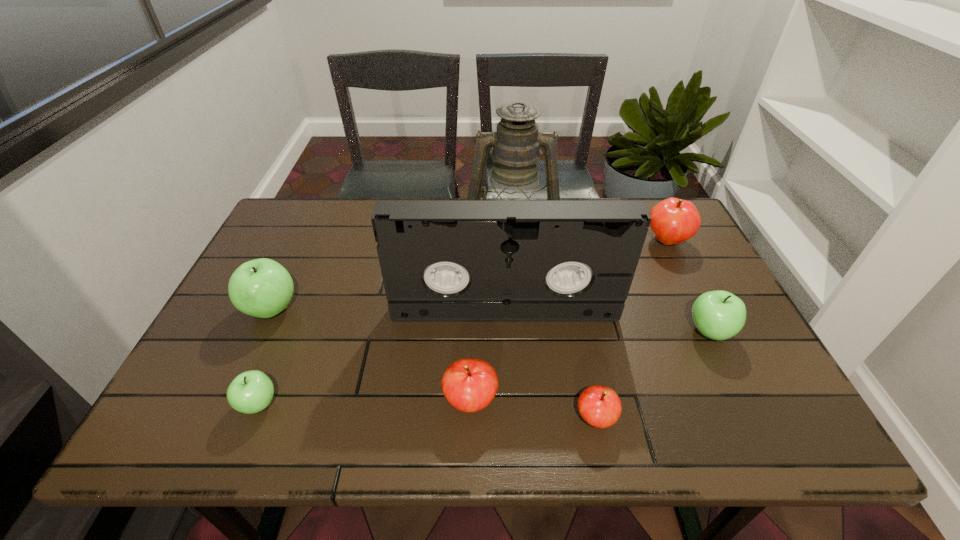
Find the location of a particular element. This screenshot has height=540, width=960. unoccupied area between the nearest green apple and the seventh shortest object is located at coordinates (381, 357).

Find the location of a particular element. free spot between the second smallest green apple and the second biggest red apple is located at coordinates (589, 366).

This screenshot has width=960, height=540. In order to click on vacant space in between the fourth apple from left to right and the biggest green apple in this screenshot , I will do `click(433, 364)`.

The image size is (960, 540). What are the coordinates of `free space between the nearest green apple and the oil lamp` in the screenshot? It's located at (385, 321).

Image resolution: width=960 pixels, height=540 pixels. I want to click on unoccupied position between the leftmost red apple and the second red apple from right to left, so click(533, 410).

Identify the location of object that ranks as the closest to the tallest object. (441, 260).

This screenshot has width=960, height=540. What are the coordinates of `the second closest object to the rightmost green apple` in the screenshot? It's located at (673, 221).

Select which apple appears as the closest to the second biggest green apple. Please provide its 2D coordinates. Your answer should be formatted as a tuple, i.e. [(x, y)], where the tuple contains the x and y coordinates of a point satisfying the conditions above.

[(673, 221)]

The height and width of the screenshot is (540, 960). Identify the location of apple that is the third closest to the fourth apple from right to left. [262, 288].

Locate which green apple is the closest to the second red apple from right to left. Please provide its 2D coordinates. Your answer should be formatted as a tuple, i.e. [(x, y)], where the tuple contains the x and y coordinates of a point satisfying the conditions above.

[(719, 315)]